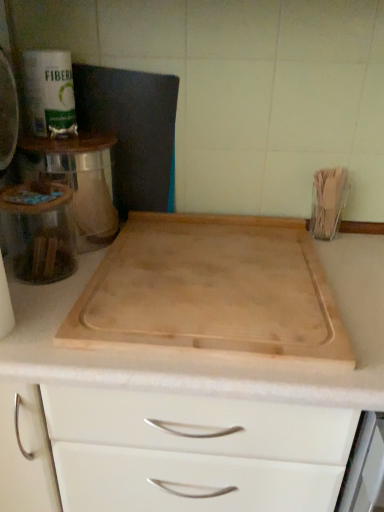
The height and width of the screenshot is (512, 384). In order to click on vacant space situated above natural wood cutting board at center (from a real-world perspective) in this screenshot , I will do `click(205, 274)`.